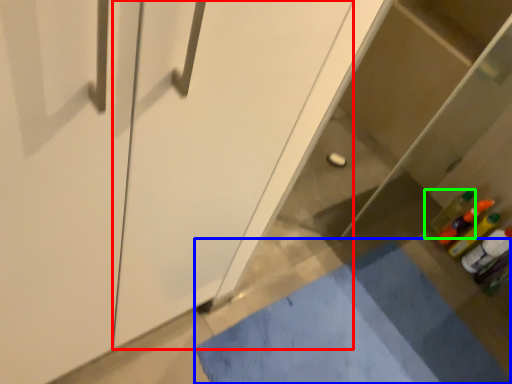
Question: Which is nearer to the screen door (highlighted by a red box)? bath mat (highlighted by a blue box) or bottle (highlighted by a green box).

Choices:
 (A) bath mat
 (B) bottle

Answer: (A)